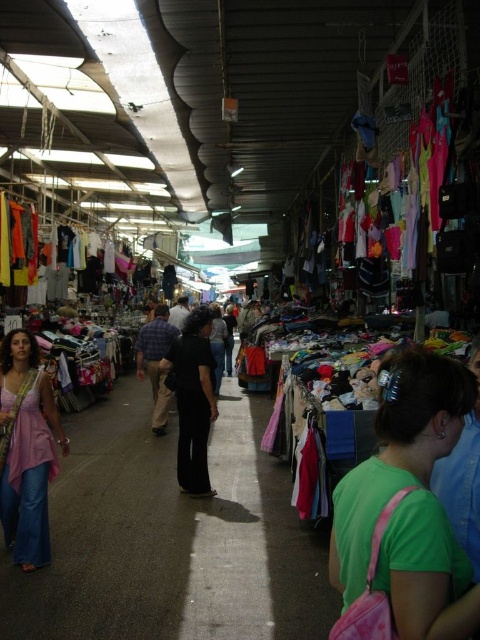
Question: Is black matte pants at center bigger than green matte shirt at lower right?

Choices:
 (A) no
 (B) yes

Answer: (B)

Question: Does green matte shirt at lower right have a lesser width compared to matte black shirt at center?

Choices:
 (A) yes
 (B) no

Answer: (A)

Question: Which object is closer to the camera taking this photo?

Choices:
 (A) green fabric bag at lower right
 (B) matte pink dress at left
 (C) green matte shirt at lower right
 (D) matte black shirt at center

Answer: (A)

Question: Among these objects, which one is nearest to the camera?

Choices:
 (A) black matte pants at center
 (B) plaid fabric shirt at center
 (C) green matte shirt at lower right

Answer: (C)

Question: Which point is closer to the camera taking this photo?

Choices:
 (A) (212, 342)
 (B) (208, 420)
 (C) (479, 477)
 (D) (157, 344)

Answer: (C)

Question: Is matte pink dress at left to the left of matte black shirt at center from the viewer's perspective?

Choices:
 (A) no
 (B) yes

Answer: (B)